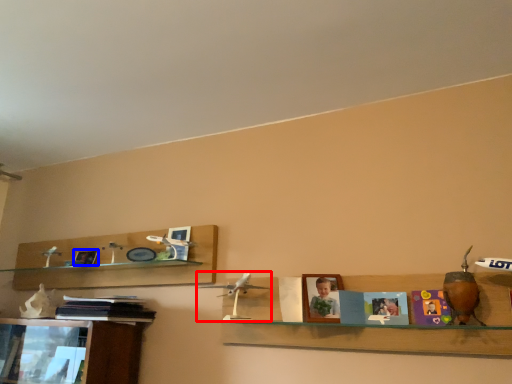
Question: Which point is closer to the camera, toy (highlighted by a red box) or picture frame (highlighted by a blue box)?

Choices:
 (A) toy
 (B) picture frame

Answer: (A)